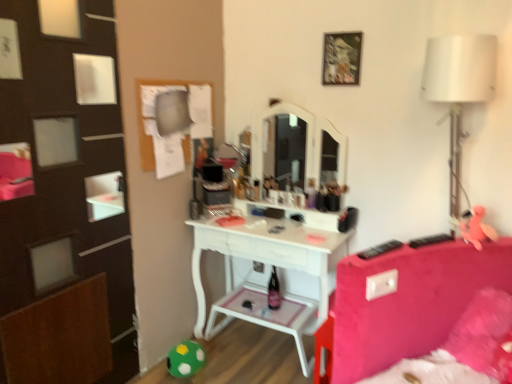
This screenshot has height=384, width=512. Identify the location of wooden picture frame at upper center. (341, 58).

What is the approximate width of white fabric lampshade at right?

white fabric lampshade at right is 11.36 inches in width.

What is the approximate height of green felt ball at lower left, which is counted as the second toy, starting from the right?

7.25 inches.

Locate an element on the screen. pink rubber duck at right, which is counted as the 2th toy, starting from the bottom is located at coordinates (476, 227).

Is white fabric lampshade at right at the left side of green felt ball at lower left, which appears as the 1th toy when viewed from the back?

Incorrect, white fabric lampshade at right is not on the left side of green felt ball at lower left, which appears as the 1th toy when viewed from the back.

Considering the relative sizes of white fabric lampshade at right and green felt ball at lower left, which appears as the 1th toy when viewed from the back, in the image provided, is white fabric lampshade at right thinner than green felt ball at lower left, which appears as the 1th toy when viewed from the back,?

No.

Is white fabric lampshade at right not close to green felt ball at lower left, the 2th toy in the top-to-bottom sequence?

Yes, white fabric lampshade at right and green felt ball at lower left, the 2th toy in the top-to-bottom sequence, are quite far apart.

Is wooden picture frame at upper center looking in the opposite direction of green felt ball at lower left, which is counted as the second toy, starting from the right?

No, green felt ball at lower left, which is counted as the second toy, starting from the right, is not at the back of wooden picture frame at upper center.

From the picture: Can you confirm if wooden picture frame at upper center is positioned to the right of green felt ball at lower left, which appears as the first toy when viewed from the left?

Indeed, wooden picture frame at upper center is positioned on the right side of green felt ball at lower left, which appears as the first toy when viewed from the left.

Would you say wooden picture frame at upper center is a long distance from green felt ball at lower left, which is counted as the second toy, starting from the right?

Absolutely, wooden picture frame at upper center is distant from green felt ball at lower left, which is counted as the second toy, starting from the right.

Is green felt ball at lower left, which appears as the first toy when viewed from the left, completely or partially inside wooden picture frame at upper center?

No.

Between wooden picture frame at upper center and pink rubber duck at right, the 1th toy when ordered from front to back, which one has smaller width?

wooden picture frame at upper center.

From a real-world perspective, is wooden picture frame at upper center on pink rubber duck at right, which is counted as the 2th toy, starting from the bottom?

Yes, from a real-world perspective, wooden picture frame at upper center is on top of pink rubber duck at right, which is counted as the 2th toy, starting from the bottom.

Is wooden picture frame at upper center oriented towards pink rubber duck at right, which is counted as the 2th toy, starting from the bottom?

No, wooden picture frame at upper center is not aimed at pink rubber duck at right, which is counted as the 2th toy, starting from the bottom.

At what (x,y) coordinates should I click in order to perform the action: click on toy on the right of wooden picture frame at upper center. Please return your answer as a coordinate pair (x, y). Looking at the image, I should click on (476, 227).

This screenshot has width=512, height=384. What are the coordinates of `picture frame that appears in front of the green felt ball at lower left, placed as the 1th toy when sorted from bottom to top` in the screenshot? It's located at (341, 58).

From the picture: Considering the relative sizes of green felt ball at lower left, which appears as the 1th toy when viewed from the back, and wooden picture frame at upper center in the image provided, is green felt ball at lower left, which appears as the 1th toy when viewed from the back, smaller than wooden picture frame at upper center?

No.

Is green felt ball at lower left, the 2th toy in the top-to-bottom sequence, not near wooden picture frame at upper center?

Indeed, green felt ball at lower left, the 2th toy in the top-to-bottom sequence, is not near wooden picture frame at upper center.

Is green felt ball at lower left, placed as the 1th toy when sorted from bottom to top, wider or thinner than wooden picture frame at upper center?

Clearly, green felt ball at lower left, placed as the 1th toy when sorted from bottom to top, has more width compared to wooden picture frame at upper center.

From the image's perspective, between pink rubber duck at right, acting as the 1th toy starting from the right, and wooden picture frame at upper center, which one is located above?

wooden picture frame at upper center, from the image's perspective.

Could you measure the distance between pink rubber duck at right, which is counted as the 2th toy, starting from the bottom, and wooden picture frame at upper center?

A distance of 38.72 inches exists between pink rubber duck at right, which is counted as the 2th toy, starting from the bottom, and wooden picture frame at upper center.

In the scene shown: Considering their positions, is pink rubber duck at right, acting as the 1th toy starting from the right, located in front of or behind wooden picture frame at upper center?

pink rubber duck at right, acting as the 1th toy starting from the right, is positioned closer to the viewer than wooden picture frame at upper center.

Is point (492, 232) more distant than point (347, 55)?

That is False.

Does green felt ball at lower left, the 2th toy in the top-to-bottom sequence, turn towards pink rubber duck at right, arranged as the first toy when viewed from the top?

No, green felt ball at lower left, the 2th toy in the top-to-bottom sequence, is not facing towards pink rubber duck at right, arranged as the first toy when viewed from the top.

Is green felt ball at lower left, which appears as the 1th toy when viewed from the back, thinner than pink rubber duck at right, the 1th toy when ordered from front to back?

No, green felt ball at lower left, which appears as the 1th toy when viewed from the back, is not thinner than pink rubber duck at right, the 1th toy when ordered from front to back.

From the image's perspective, which one is positioned lower, green felt ball at lower left, which appears as the second toy when viewed from the front, or pink rubber duck at right, arranged as the first toy when viewed from the top?

From the image's view, green felt ball at lower left, which appears as the second toy when viewed from the front, is below.

Is green felt ball at lower left, the 2th toy in the top-to-bottom sequence, inside the boundaries of pink rubber duck at right, which is counted as the 2th toy, starting from the bottom, or outside?

green felt ball at lower left, the 2th toy in the top-to-bottom sequence, is outside pink rubber duck at right, which is counted as the 2th toy, starting from the bottom.

Which object is thinner, pink rubber duck at right, acting as the 1th toy starting from the right, or white fabric lampshade at right?

Thinner between the two is pink rubber duck at right, acting as the 1th toy starting from the right.

Is point (466, 240) more distant than point (452, 217)?

No, it is in front of (452, 217).

Looking at this image, how far apart are pink rubber duck at right, arranged as the first toy when viewed from the top, and white fabric lampshade at right?

A distance of 18.11 inches exists between pink rubber duck at right, arranged as the first toy when viewed from the top, and white fabric lampshade at right.

Locate an element on the screen. Image resolution: width=512 pixels, height=384 pixels. table lamp above the green felt ball at lower left, which is counted as the second toy, starting from the right (from a real-world perspective) is located at coordinates (459, 88).

The height and width of the screenshot is (384, 512). I want to click on toy that appears behind the wooden picture frame at upper center, so click(x=185, y=359).

From the image, which object appears to be farther from white fabric lampshade at right, green felt ball at lower left, the 2th toy in the top-to-bottom sequence, or wooden picture frame at upper center?

green felt ball at lower left, the 2th toy in the top-to-bottom sequence, lies further to white fabric lampshade at right than the other object.

When comparing their distances from white fabric lampshade at right, does wooden picture frame at upper center or green felt ball at lower left, the 2th toy in the top-to-bottom sequence, seem further?

green felt ball at lower left, the 2th toy in the top-to-bottom sequence, is positioned further to the anchor white fabric lampshade at right.

Estimate the real-world distances between objects in this image. Which object is further from wooden picture frame at upper center, pink rubber duck at right, arranged as the first toy when viewed from the top, or white fabric lampshade at right?

pink rubber duck at right, arranged as the first toy when viewed from the top, is positioned further to the anchor wooden picture frame at upper center.

Looking at the image, which one is located further to green felt ball at lower left, the 2th toy in the top-to-bottom sequence, white fabric lampshade at right or pink rubber duck at right, the 1th toy when ordered from front to back?

Based on the image, white fabric lampshade at right appears to be further to green felt ball at lower left, the 2th toy in the top-to-bottom sequence.

From the image, which object appears to be nearer to wooden picture frame at upper center, green felt ball at lower left, which is counted as the second toy, starting from the right, or white fabric lampshade at right?

white fabric lampshade at right is closer to wooden picture frame at upper center.

Based on their spatial positions, is wooden picture frame at upper center or white fabric lampshade at right further from green felt ball at lower left, which is counted as the second toy, starting from the right?

white fabric lampshade at right lies further to green felt ball at lower left, which is counted as the second toy, starting from the right, than the other object.

Which object lies nearer to the anchor point green felt ball at lower left, which appears as the first toy when viewed from the left, pink rubber duck at right, which is counted as the 2th toy, starting from the bottom, or white fabric lampshade at right?

pink rubber duck at right, which is counted as the 2th toy, starting from the bottom, is closer to green felt ball at lower left, which appears as the first toy when viewed from the left.

When comparing their distances from white fabric lampshade at right, does wooden picture frame at upper center or pink rubber duck at right, which is counted as the 2th toy, starting from the bottom, seem closer?

pink rubber duck at right, which is counted as the 2th toy, starting from the bottom, is closer to white fabric lampshade at right.

I want to click on toy between wooden picture frame at upper center and green felt ball at lower left, placed as the 1th toy when sorted from bottom to top, from top to bottom, so (x=476, y=227).

At what (x,y) coordinates should I click in order to perform the action: click on table lamp located between green felt ball at lower left, which appears as the first toy when viewed from the left, and pink rubber duck at right, the 1th toy when ordered from front to back, in the left-right direction. Please return your answer as a coordinate pair (x, y). Looking at the image, I should click on (459, 88).

What are the coordinates of `table lamp between wooden picture frame at upper center and pink rubber duck at right, which is the second toy in back-to-front order, vertically` in the screenshot? It's located at (459, 88).

Locate an element on the screen. This screenshot has width=512, height=384. table lamp that lies between wooden picture frame at upper center and green felt ball at lower left, which appears as the second toy when viewed from the front, from top to bottom is located at coordinates (459, 88).